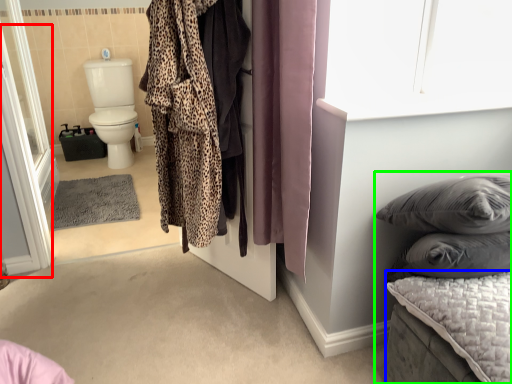
Question: Considering the real-world distances, which object is closest to screen door (highlighted by a red box)? mattress (highlighted by a blue box) or furniture (highlighted by a green box).

Choices:
 (A) mattress
 (B) furniture

Answer: (B)